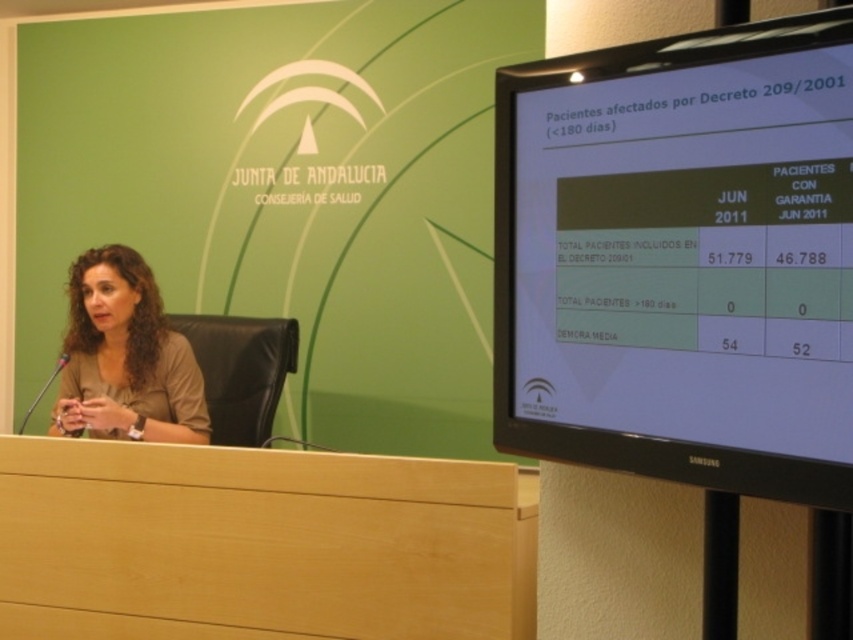
Between black glossy monitor at upper right and light wood table at lower left, which one has more height?

With more height is black glossy monitor at upper right.

Is black glossy monitor at upper right above light wood table at lower left?

Yes.

You are a GUI agent. You are given a task and a screenshot of the screen. Output one action in this format:
    pyautogui.click(x=<x>, y=<y>)
    Task: Click on the black glossy monitor at upper right
    Image resolution: width=853 pixels, height=640 pixels.
    Given the screenshot: What is the action you would take?
    pyautogui.click(x=682, y=259)

Identify the location of black glossy monitor at upper right. The image size is (853, 640). (682, 259).

From the picture: Is light wood table at lower left behind matte brown hair at center?

No, it is in front of matte brown hair at center.

Is light wood table at lower left closer to camera compared to matte brown hair at center?

Yes, light wood table at lower left is closer to the viewer.

Measure the distance between point (90, 531) and camera.

Point (90, 531) and camera are 1.99 meters apart.

The width and height of the screenshot is (853, 640). In order to click on light wood table at lower left in this screenshot , I will do `click(270, 538)`.

Is the position of black glossy monitor at upper right more distant than that of matte brown hair at center?

No, it is in front of matte brown hair at center.

Is point (708, 372) less distant than point (161, 365)?

Yes, point (708, 372) is closer to viewer.

This screenshot has height=640, width=853. In order to click on black glossy monitor at upper right in this screenshot , I will do `click(682, 259)`.